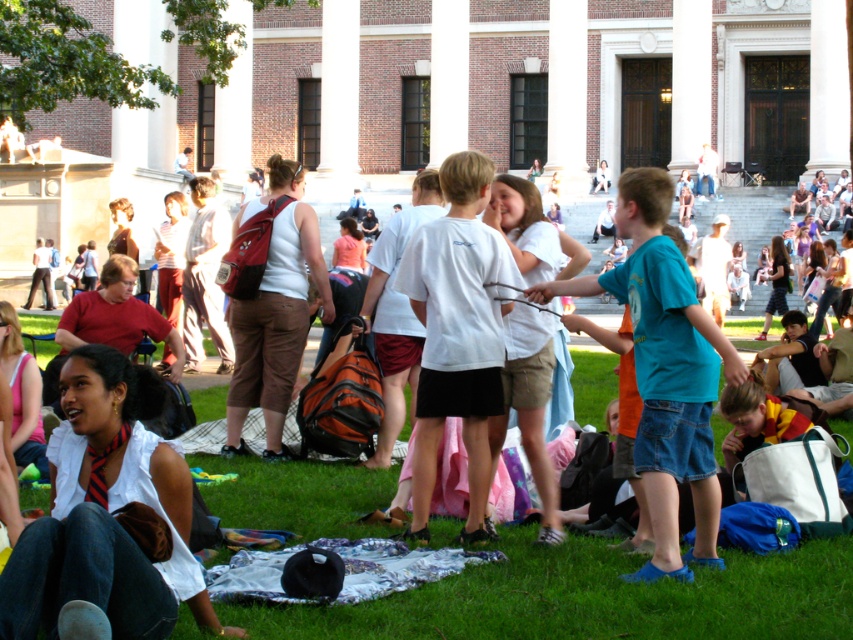
Can you confirm if teal denim shorts at center is shorter than white matte t-shirt at center?

Yes.

From the picture: Which of these two, teal denim shorts at center or white matte t-shirt at center, stands taller?

With more height is white matte t-shirt at center.

Is point (668, 548) positioned behind point (500, 289)?

No, (668, 548) is in front of (500, 289).

Find the location of `teal denim shorts at center`. teal denim shorts at center is located at coordinates (665, 371).